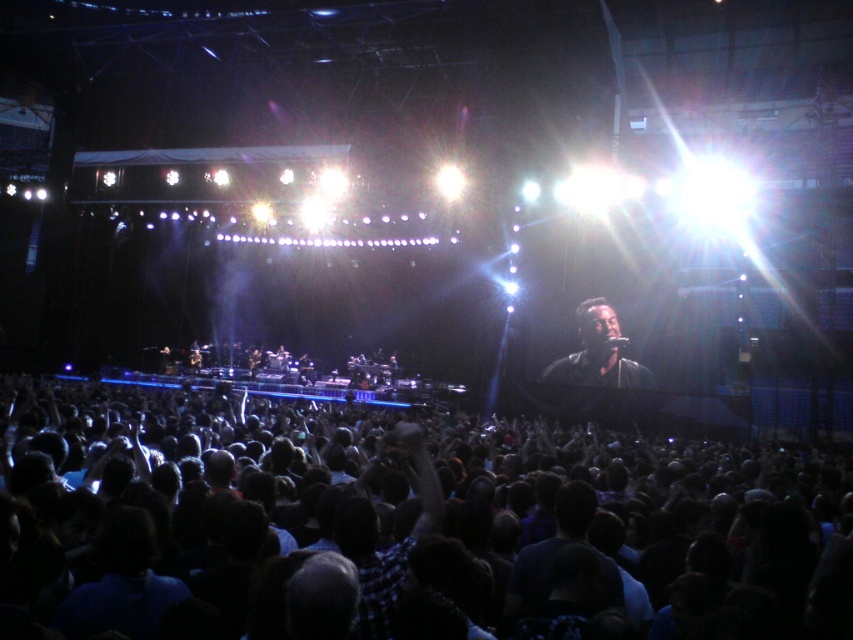
Question: Can you confirm if dark hair crowd at center is positioned to the left of black matte microphone at center?

Choices:
 (A) yes
 (B) no

Answer: (A)

Question: Which point is closer to the camera taking this photo?

Choices:
 (A) (579, 376)
 (B) (550, 444)

Answer: (B)

Question: Among these points, which one is nearest to the camera?

Choices:
 (A) (606, 317)
 (B) (254, 605)

Answer: (B)

Question: Can you confirm if dark hair crowd at center is positioned to the left of black matte microphone at center?

Choices:
 (A) no
 (B) yes

Answer: (B)

Question: Is dark hair crowd at center below black matte microphone at center?

Choices:
 (A) no
 (B) yes

Answer: (B)